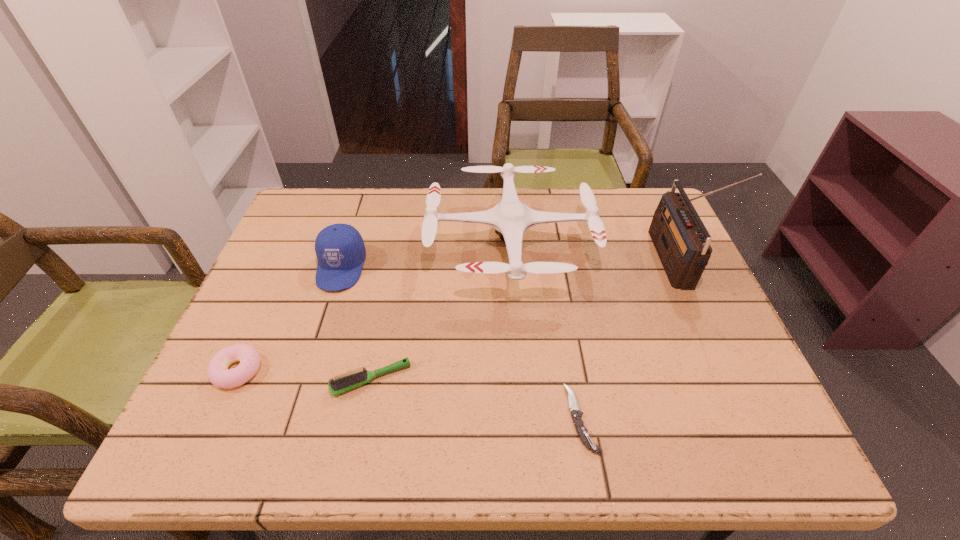
Where is `the tallest object`? the tallest object is located at coordinates (682, 242).

What are the coordinates of `the rightmost object` in the screenshot? It's located at (682, 242).

You are a GUI agent. You are given a task and a screenshot of the screen. Output one action in this format:
    pyautogui.click(x=<x>, y=<y>)
    Task: Click on the drone
    This screenshot has width=960, height=540.
    Given the screenshot: What is the action you would take?
    511,218

The image size is (960, 540). What are the coordinates of `the third tallest object` in the screenshot? It's located at (340, 250).

Image resolution: width=960 pixels, height=540 pixels. Identify the location of doughnut. pos(218,373).

You are a GUI agent. You are given a task and a screenshot of the screen. Output one action in this format:
    pyautogui.click(x=<x>, y=<y>)
    Task: Click on the hairbrush
    
    Given the screenshot: What is the action you would take?
    pyautogui.click(x=338, y=385)

Find the location of a particular element. pocketknife is located at coordinates (582, 432).

Where is `vacant area situated on the front-facing side of the radio receiver`? The height and width of the screenshot is (540, 960). vacant area situated on the front-facing side of the radio receiver is located at coordinates (556, 261).

I want to click on vacant space located 0.380m on the front-facing side of the radio receiver, so click(x=518, y=261).

Image resolution: width=960 pixels, height=540 pixels. Find the location of `vacant area situated 0.160m on the front-facing side of the radio receiver`. vacant area situated 0.160m on the front-facing side of the radio receiver is located at coordinates 600,261.